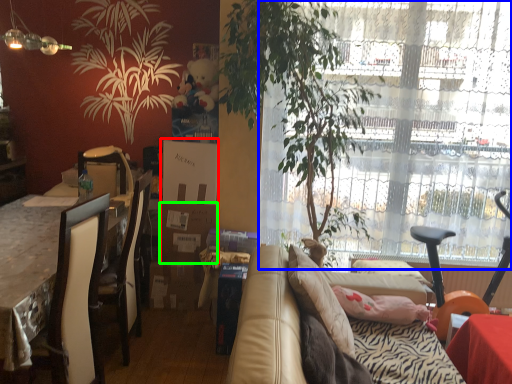
Question: Based on their relative distances, which object is nearer to box (highlighted by a red box)? Choose from window (highlighted by a blue box) and cardboard box (highlighted by a green box).

Choices:
 (A) window
 (B) cardboard box

Answer: (B)